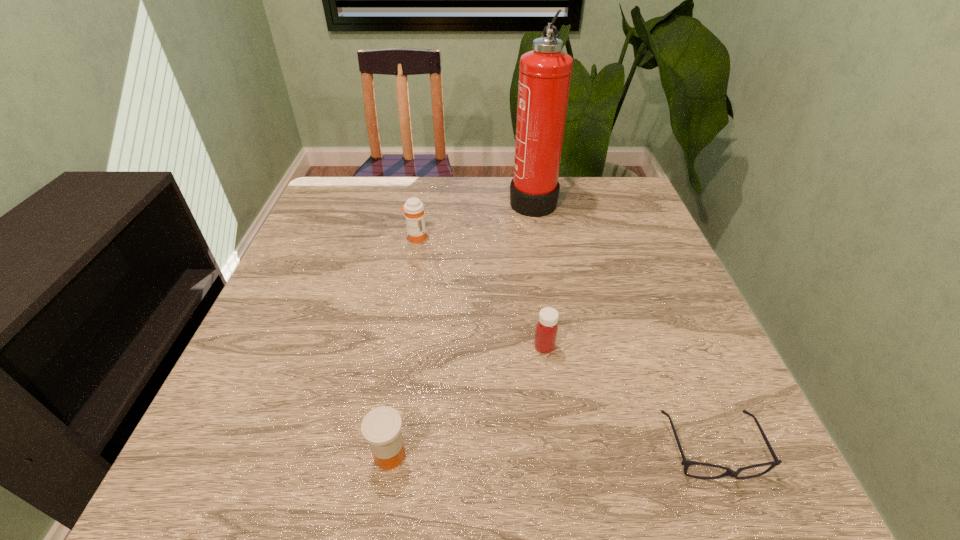
Find the location of a particular element. free space located on the front-facing side of the fire extinguisher is located at coordinates (481, 199).

Image resolution: width=960 pixels, height=540 pixels. What are the coordinates of `vacant space positioned on the front of the fourth nearest object` in the screenshot? It's located at click(396, 344).

Locate an element on the screen. This screenshot has width=960, height=540. free space located on the front of the rightmost medicine is located at coordinates (564, 485).

At what (x,y) coordinates should I click in order to perform the action: click on free space located 0.240m on the label of the nearest medicine. Please return your answer as a coordinate pair (x, y). The image size is (960, 540). Looking at the image, I should click on pyautogui.click(x=557, y=455).

Find the location of a particular element. object positioned at the far edge is located at coordinates (545, 72).

Image resolution: width=960 pixels, height=540 pixels. Identify the location of medicine that is at the near edge. (381, 427).

The image size is (960, 540). I want to click on spectacles present at the near edge, so click(x=686, y=463).

The width and height of the screenshot is (960, 540). I want to click on object present at the right edge, so click(686, 463).

The image size is (960, 540). What are the coordinates of `object situated at the near right corner` in the screenshot? It's located at (686, 463).

What are the coordinates of `free space at the far edge of the desktop` in the screenshot? It's located at (419, 181).